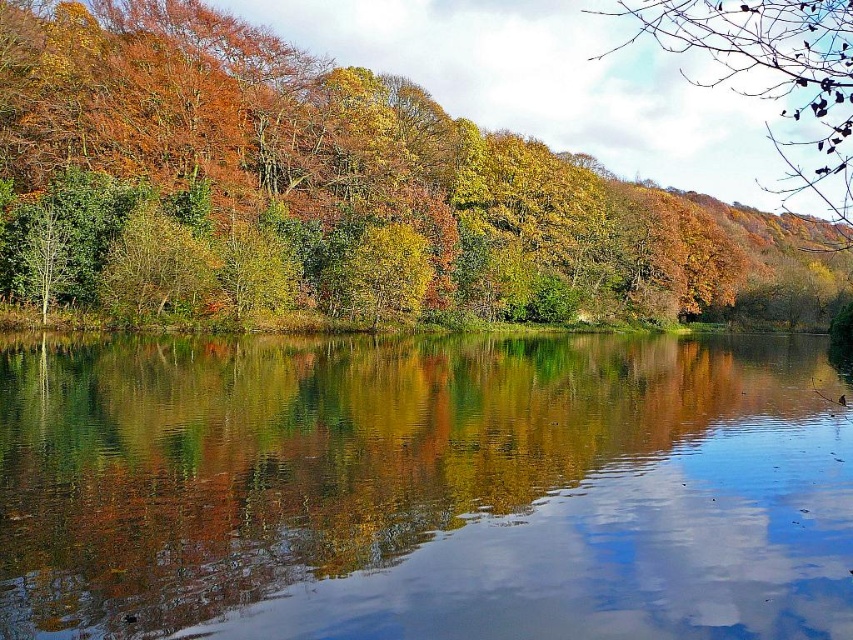
Measure the distance between autumn leaves at upper right and green matte tree at center.

autumn leaves at upper right and green matte tree at center are 68.14 meters apart.

Is autumn leaves at upper right below green matte tree at center?

No, autumn leaves at upper right is not below green matte tree at center.

Is point (816, 10) farther from camera compared to point (144, 237)?

No, (816, 10) is in front of (144, 237).

Where is `autumn leaves at upper right`? autumn leaves at upper right is located at coordinates (773, 77).

Is autumn leaves at center smaller than autumn leaves at upper right?

Incorrect, autumn leaves at center is not smaller in size than autumn leaves at upper right.

Does autumn leaves at center have a greater height compared to autumn leaves at upper right?

No.

Between point (45, 113) and point (776, 83), which one is positioned in front?

Positioned in front is point (45, 113).

Find the location of a particular element. autumn leaves at center is located at coordinates (299, 180).

How much distance is there between green matte tree at center and yellow-green leafy tree at center?

green matte tree at center is 13.59 meters from yellow-green leafy tree at center.

Does green matte tree at center have a greater height compared to yellow-green leafy tree at center?

Correct, green matte tree at center is much taller as yellow-green leafy tree at center.

Where is `green matte tree at center`? green matte tree at center is located at coordinates (157, 266).